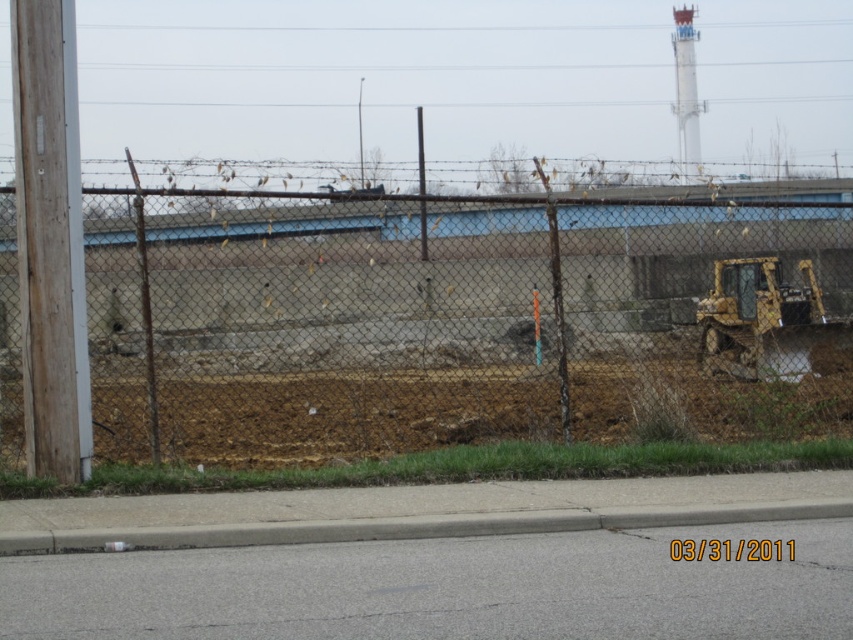
This screenshot has height=640, width=853. What do you see at coordinates (463, 328) in the screenshot?
I see `rusty chain-link fence at center` at bounding box center [463, 328].

Is rusty chain-link fence at center smaller than yellow metallic excavator at right?

Yes.

Who is more forward, [735,234] or [759,323]?

Positioned in front is point [735,234].

You are a GUI agent. You are given a task and a screenshot of the screen. Output one action in this format:
    pyautogui.click(x=<x>, y=<y>)
    Task: Click on the rusty chain-link fence at center
    This screenshot has height=640, width=853.
    Given the screenshot: What is the action you would take?
    pyautogui.click(x=463, y=328)

Is rusty chain-link fence at center closer to camera compared to gray concrete curb at lower center?

That is False.

Between rusty chain-link fence at center and gray concrete curb at lower center, which one has less height?

gray concrete curb at lower center is shorter.

Is point (670, 209) positioned after point (184, 531)?

Yes, point (670, 209) is farther from viewer.

Find the location of `rusty chain-link fence at center`. rusty chain-link fence at center is located at coordinates (463, 328).

From the picture: Is gray concrete curb at lower center wider than yellow metallic excavator at right?

Indeed, gray concrete curb at lower center has a greater width compared to yellow metallic excavator at right.

Does gray concrete curb at lower center have a lesser width compared to yellow metallic excavator at right?

In fact, gray concrete curb at lower center might be wider than yellow metallic excavator at right.

The image size is (853, 640). What do you see at coordinates (412, 525) in the screenshot?
I see `gray concrete curb at lower center` at bounding box center [412, 525].

Find the location of a particular element. gray concrete curb at lower center is located at coordinates (412, 525).